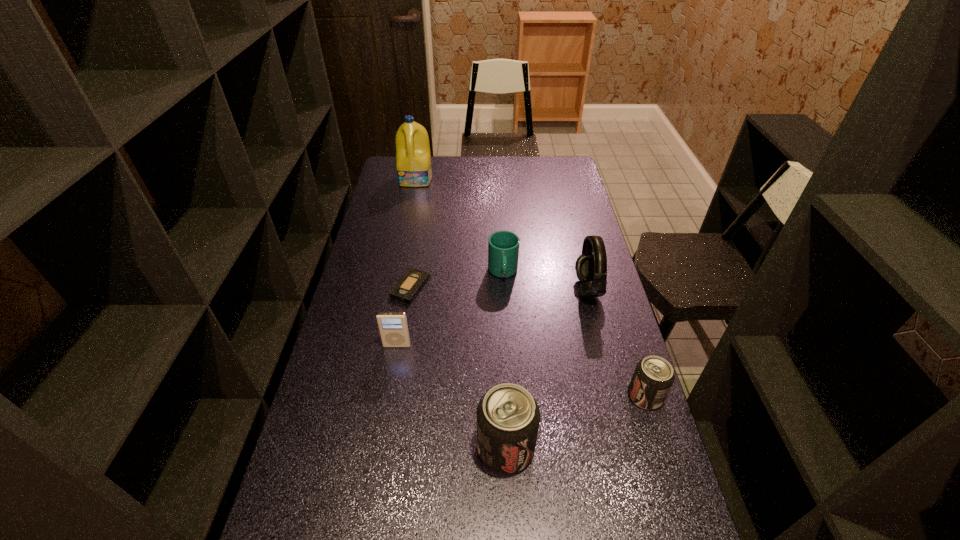
Locate an element on the screen. detergent present at the left edge is located at coordinates (413, 159).

Identify the location of iPod at the left edge. Image resolution: width=960 pixels, height=540 pixels. (393, 327).

Find the location of a particular element. The image size is (960, 540). videotape present at the left edge is located at coordinates click(x=408, y=287).

The width and height of the screenshot is (960, 540). Find the location of `soda can positioned at the right edge`. soda can positioned at the right edge is located at coordinates (653, 377).

What are the coordinates of `headset that is at the right edge` in the screenshot? It's located at (591, 267).

Where is `object that is positioned at the far left corner`? The width and height of the screenshot is (960, 540). object that is positioned at the far left corner is located at coordinates (413, 159).

At what (x,y) coordinates should I click in order to perform the action: click on vacant area at the far edge of the desktop. Please return your answer as a coordinate pair (x, y). This screenshot has width=960, height=540. Looking at the image, I should click on (x=497, y=166).

You are a GUI agent. You are given a task and a screenshot of the screen. Output one action in this format:
    pyautogui.click(x=<x>, y=<y>)
    Task: Click on the vacant space at the left edge of the desktop
    
    Given the screenshot: What is the action you would take?
    pyautogui.click(x=363, y=312)

Locate an element on the screen. vacant space at the right edge of the desktop is located at coordinates (581, 254).

Identify the location of vacant space at the far left corner of the desktop. This screenshot has height=540, width=960. (389, 174).